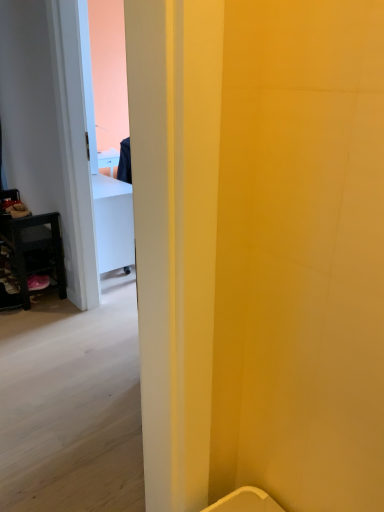
You are a GUI agent. You are given a task and a screenshot of the screen. Output one action in this format:
    pyautogui.click(x=<x>, y=<y>)
    Task: Click on the matte black shelf at left
    
    Given the screenshot: What is the action you would take?
    pyautogui.click(x=34, y=247)

The image size is (384, 512). What do you see at coordinates (34, 247) in the screenshot?
I see `matte black shelf at left` at bounding box center [34, 247].

Locate an element on the screen. The image size is (384, 512). matte black shelf at left is located at coordinates (34, 247).